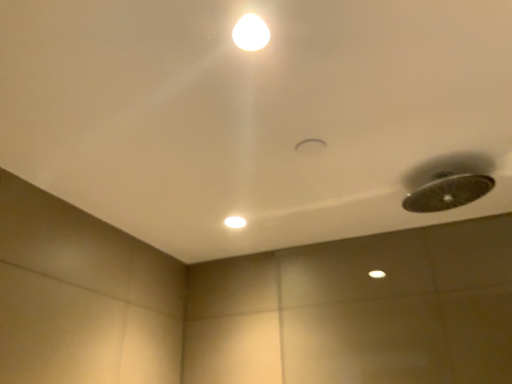
Question: Which is correct: matte white light at center is inside white glossy light at upper center, or outside of it?

Choices:
 (A) outside
 (B) inside

Answer: (A)

Question: Is point (245, 223) closer or farther from the camera than point (253, 44)?

Choices:
 (A) farther
 (B) closer

Answer: (A)

Question: Is matte white light at center to the left or to the right of white glossy light at upper center in the image?

Choices:
 (A) left
 (B) right

Answer: (A)

Question: From a real-world perspective, is white glossy light at upper center positioned above or below matte white light at center?

Choices:
 (A) above
 (B) below

Answer: (A)

Question: Is white glossy light at upper center taller or shorter than matte white light at center?

Choices:
 (A) tall
 (B) short

Answer: (B)

Question: Considering the positions of white glossy light at upper center and matte white light at center in the image, is white glossy light at upper center bigger or smaller than matte white light at center?

Choices:
 (A) big
 (B) small

Answer: (B)

Question: In the image, is white glossy light at upper center positioned in front of or behind matte white light at center?

Choices:
 (A) behind
 (B) front

Answer: (B)